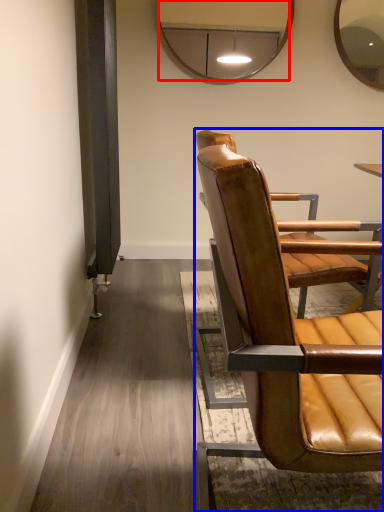
Question: Which point is closer to the camera, mirror (highlighted by a red box) or chair (highlighted by a blue box)?

Choices:
 (A) mirror
 (B) chair

Answer: (B)